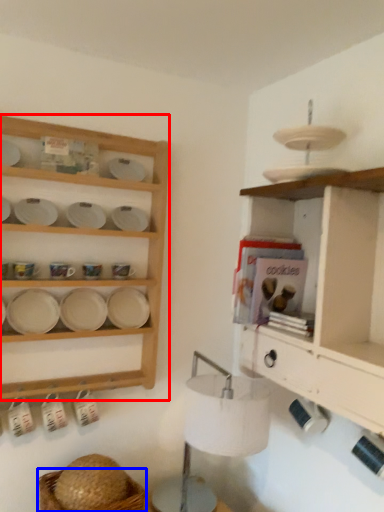
Question: Among these objects, which one is farthest to the camera, shelf (highlighted by a red box) or basket (highlighted by a blue box)?

Choices:
 (A) shelf
 (B) basket

Answer: (A)